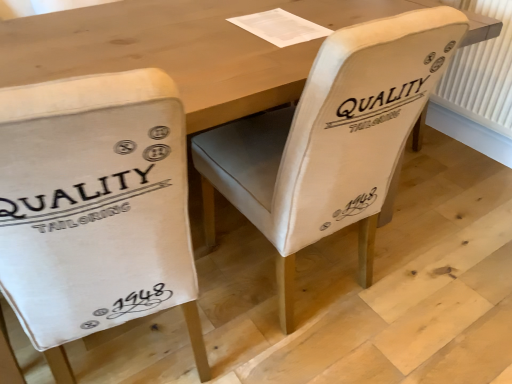
Locate an element on the screen. vacant area that is in front of white fabric chair at center, which appears as the first chair when viewed from the right is located at coordinates (319, 350).